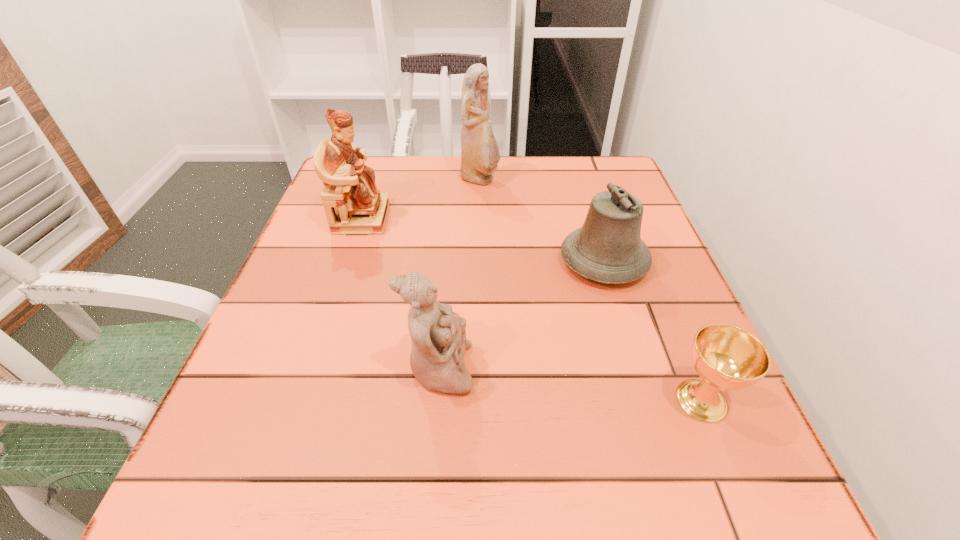
The image size is (960, 540). I want to click on the farthest figurine, so click(x=480, y=155).

Image resolution: width=960 pixels, height=540 pixels. I want to click on the leftmost object, so pos(349,185).

Locate an element on the screen. This screenshot has width=960, height=540. the second nearest figurine is located at coordinates (349, 185).

Identify the location of the third shortest object. The height and width of the screenshot is (540, 960). (438, 335).

Locate an element on the screen. The width and height of the screenshot is (960, 540). the nearest figurine is located at coordinates (438, 335).

You are a GUI agent. You are given a task and a screenshot of the screen. Output one action in this format:
    pyautogui.click(x=<x>, y=<y>)
    Task: Click on the fourth tallest object
    
    Given the screenshot: What is the action you would take?
    pyautogui.click(x=608, y=248)

Where is `the shortest object`? Image resolution: width=960 pixels, height=540 pixels. the shortest object is located at coordinates click(726, 357).

This screenshot has height=540, width=960. Identify the location of vacant area situated 0.090m on the front-facing side of the farthest object. (535, 180).

Image resolution: width=960 pixels, height=540 pixels. In order to click on free region located 0.080m on the front-facing side of the leftmost object in this screenshot , I will do `click(421, 218)`.

Image resolution: width=960 pixels, height=540 pixels. In order to click on vacant space located 0.260m on the front-facing side of the third tallest object in this screenshot , I will do `click(635, 369)`.